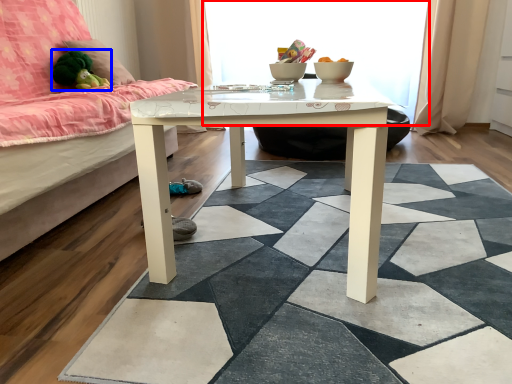
Question: Among these objects, which one is nearest to the camera, window screen (highlighted by a red box) or toy (highlighted by a blue box)?

Choices:
 (A) window screen
 (B) toy

Answer: (B)